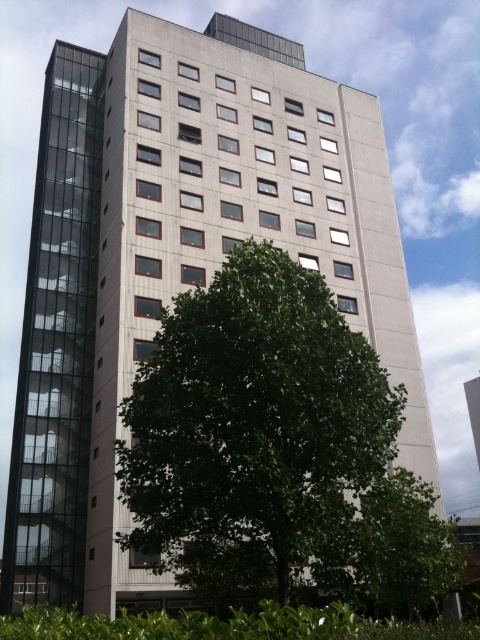
Does green leafy tree at center come behind green leafy hedge at lower center?

Yes, it is behind green leafy hedge at lower center.

Is point (305, 342) in front of point (285, 620)?

No, (305, 342) is further to viewer.

Locate an element on the screen. The width and height of the screenshot is (480, 640). green leafy tree at center is located at coordinates (x=254, y=433).